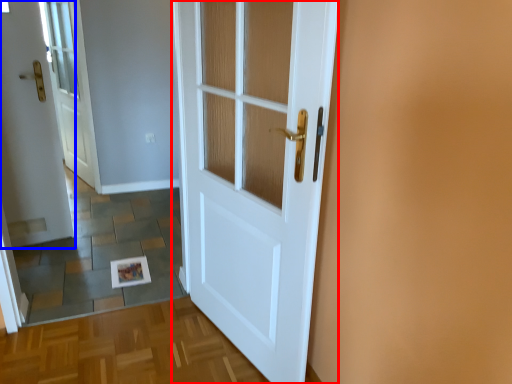
Question: Which object is closer to the camera taking this photo, door (highlighted by a red box) or door (highlighted by a blue box)?

Choices:
 (A) door
 (B) door

Answer: (A)